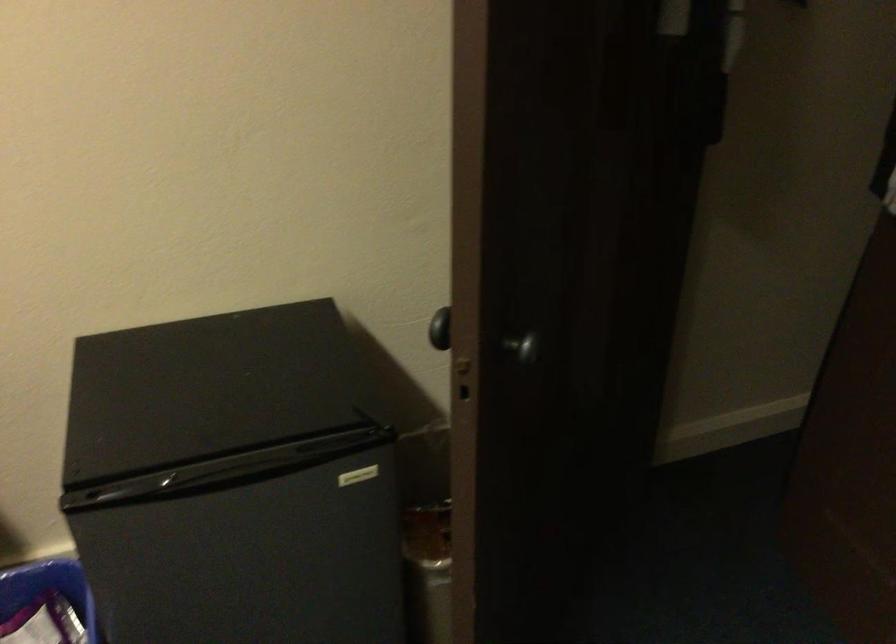
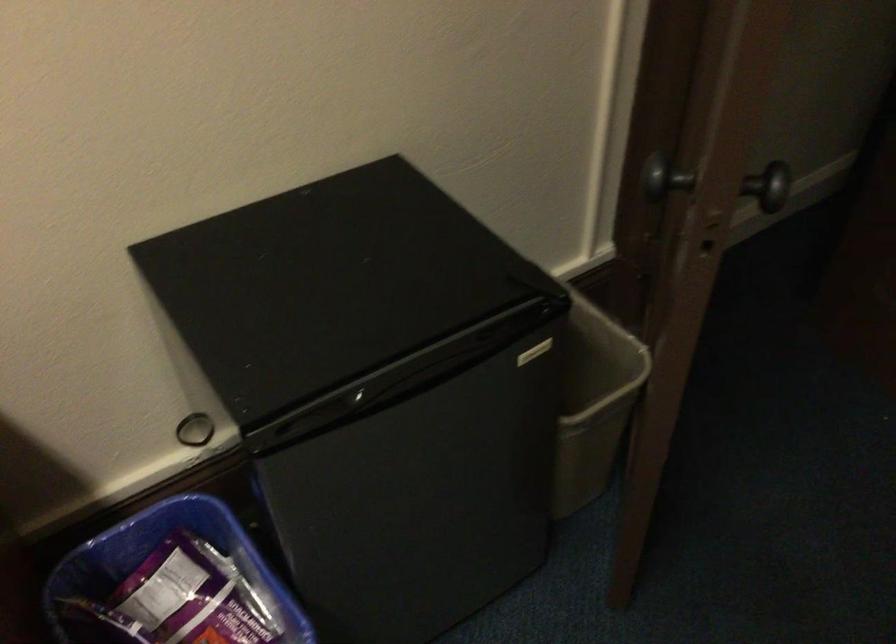
In the second image, find the point that corresponds to pixel 530 343 in the first image.

(771, 185)